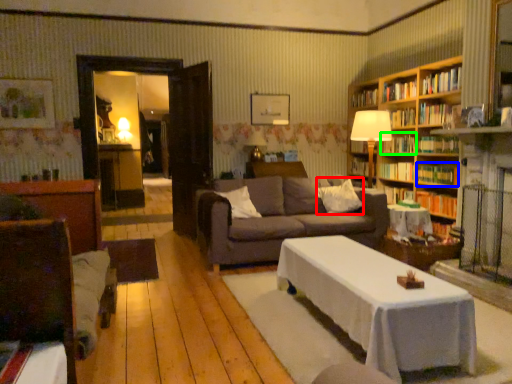
Question: Which is farther away from pillow (highlighted by a red box)? book (highlighted by a blue box) or book (highlighted by a green box)?

Choices:
 (A) book
 (B) book

Answer: (B)